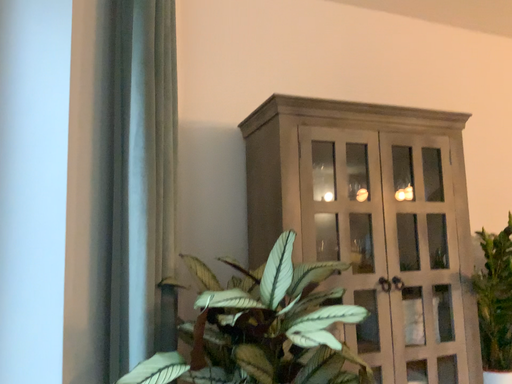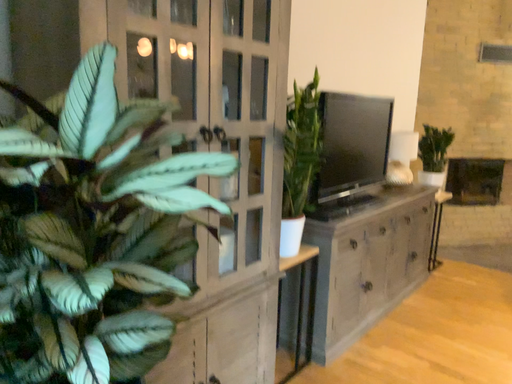
Question: How did the camera likely rotate when shooting the video?

Choices:
 (A) rotated downward
 (B) rotated upward

Answer: (A)